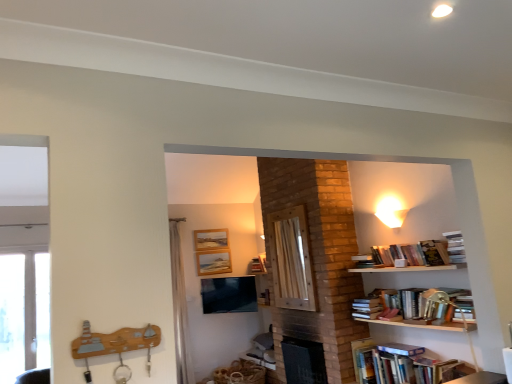
Locate an element on the screen. free point below wooden screen door at center (from a real-world perspective) is located at coordinates (300, 345).